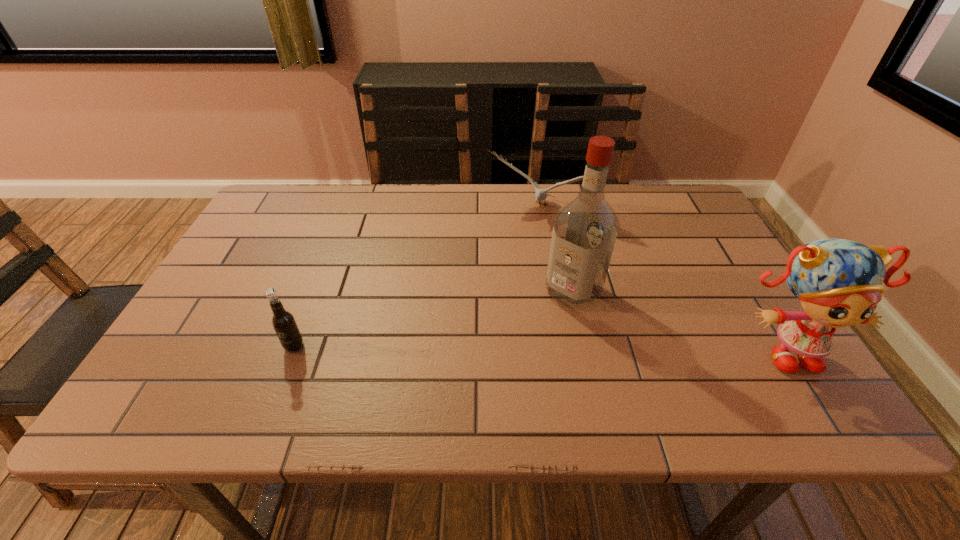
I want to click on free spot on the desktop that is between the root beer and the second tallest object and is positioned at the tip of the beak of the gull, so click(472, 347).

This screenshot has height=540, width=960. I want to click on vacant spot on the desktop that is between the leftmost object and the doll and is positioned on the front-facing side of the third nearest object, so click(x=519, y=347).